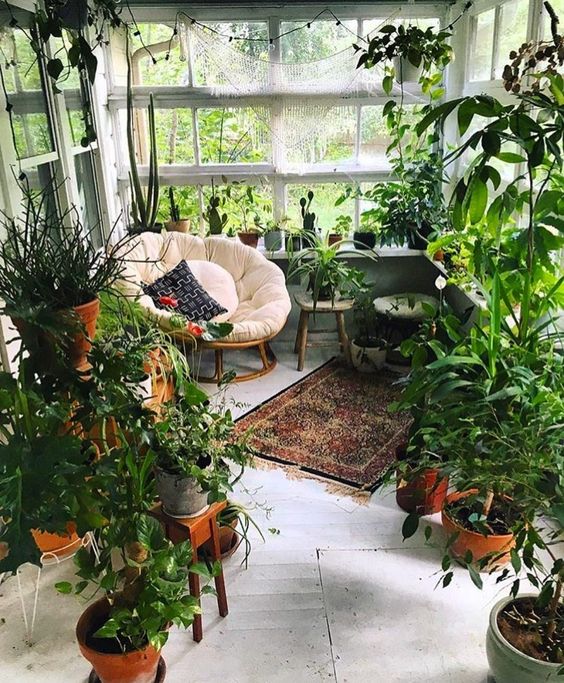
Identify the location of fringed rug. This screenshot has height=683, width=564. (332, 447).